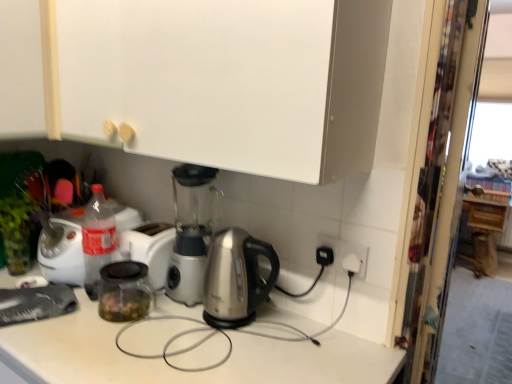
Question: Does point (463, 220) appear closer or farther from the camera than point (422, 279)?

Choices:
 (A) farther
 (B) closer

Answer: (A)

Question: Choose the correct answer: Is wooden cabinet at right, arranged as the third cabinetry when viewed from the front, inside transparent plastic screen door at right or outside it?

Choices:
 (A) outside
 (B) inside

Answer: (A)

Question: Estimate the real-world distances between objects in this image. Which object is closer to the satin silver kettle at center?

Choices:
 (A) white matte cabinet at upper center, arranged as the second cabinetry when viewed from the left
 (B) wooden cabinet at right, the third cabinetry from the left
 (C) transparent plastic screen door at right
 (D) white matte cabinet at upper left, the 2th cabinetry viewed from the back

Answer: (C)

Question: Estimate the real-world distances between objects in this image. Which object is farther from the transparent plastic screen door at right?

Choices:
 (A) white matte cabinet at upper center, arranged as the third cabinetry when viewed from the back
 (B) wooden cabinet at right, which is the 1th cabinetry from back to front
 (C) satin silver kettle at center
 (D) white matte cabinet at upper left, placed as the first cabinetry when sorted from left to right

Answer: (B)